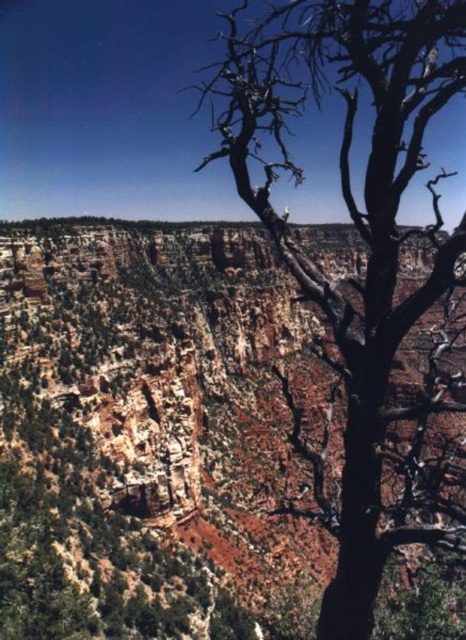
Looking at this image, you are standing at the point marked as point (159, 435) in the canyon landscape. What can you see directly in front of you?

At point (159, 435) lies rustic rock canyon at center, so you can see rustic rock canyon at center directly in front of you.

You are an artist planning to paint the scene. You want to ensure the dead wood tree at right is taller than the rustic rock canyon at center in your painting. Is this possible based on the actual scene?

The rustic rock canyon at center is not as tall as the dead wood tree at right, so yes, it is possible to paint the dead wood tree at right taller than the rustic rock canyon at center in your artwork.

Based on the photo, you are standing in the canyon and want to take a photo of the rustic rock canyon at center and the dead wood tree at right. Which object should you focus on first to ensure both are in the frame?

You should focus on the dead wood tree at right first because it is closer to you than the rustic rock canyon at center, which is further away. This way, both objects will be in the frame when properly focused.